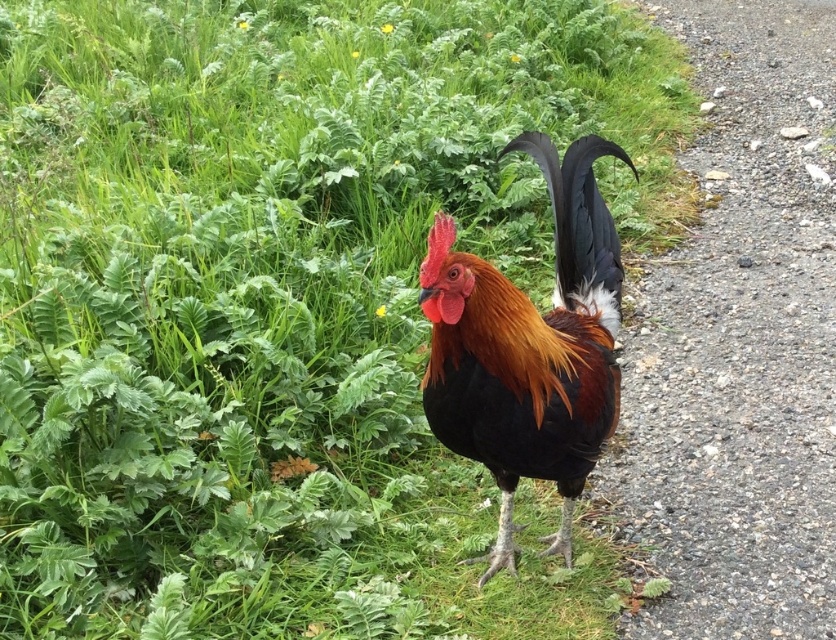
You are standing at point (513, 529) and want to walk to the gravel path on the right. Is the point (766, 108) behind you or in front of you?

Point (766, 108) is behind point (513, 529), so it is behind you.

You are a hiker who wants to walk along the gravelly path at right. However, you notice the shiny black rooster at center is blocking the path. Can you walk around the rooster without stepping off the path?

The gravelly path at right is above the shiny black rooster at center, meaning the rooster is positioned below the path. Therefore, you can walk along the gravelly path at right without needing to step off, as the rooster is not directly blocking the path itself.